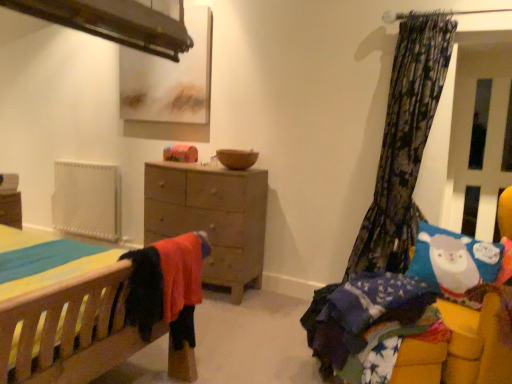
Question: Could you tell me if matte brown picture frame at upper center is facing fluffy blue blanket at lower right, placed as the 2th bed when sorted from left to right?

Choices:
 (A) yes
 (B) no

Answer: (B)

Question: From a real-world perspective, is matte brown picture frame at upper center beneath fluffy blue blanket at lower right, which is the 1th bed in right-to-left order?

Choices:
 (A) no
 (B) yes

Answer: (A)

Question: Is matte brown picture frame at upper center taller than fluffy blue blanket at lower right, placed as the 2th bed when sorted from left to right?

Choices:
 (A) yes
 (B) no

Answer: (A)

Question: Is matte brown picture frame at upper center outside of fluffy blue blanket at lower right, which is the 1th bed in right-to-left order?

Choices:
 (A) yes
 (B) no

Answer: (A)

Question: Considering the relative positions of matte brown picture frame at upper center and fluffy blue blanket at lower right, which is the 1th bed in right-to-left order, in the image provided, is matte brown picture frame at upper center to the left of fluffy blue blanket at lower right, which is the 1th bed in right-to-left order, from the viewer's perspective?

Choices:
 (A) no
 (B) yes

Answer: (B)

Question: Does matte brown picture frame at upper center touch fluffy blue blanket at lower right, which is the 1th bed in right-to-left order?

Choices:
 (A) yes
 (B) no

Answer: (B)

Question: Does matte brown picture frame at upper center have a greater height compared to transparent plastic screen door at right?

Choices:
 (A) no
 (B) yes

Answer: (A)

Question: Can you confirm if matte brown picture frame at upper center is wider than transparent plastic screen door at right?

Choices:
 (A) no
 (B) yes

Answer: (B)

Question: Can you confirm if matte brown picture frame at upper center is bigger than transparent plastic screen door at right?

Choices:
 (A) yes
 (B) no

Answer: (A)

Question: Does matte brown picture frame at upper center have a lesser width compared to transparent plastic screen door at right?

Choices:
 (A) no
 (B) yes

Answer: (A)

Question: Is matte brown picture frame at upper center oriented towards transparent plastic screen door at right?

Choices:
 (A) yes
 (B) no

Answer: (B)

Question: Considering the relative positions of matte brown picture frame at upper center and transparent plastic screen door at right in the image provided, is matte brown picture frame at upper center to the right of transparent plastic screen door at right from the viewer's perspective?

Choices:
 (A) yes
 (B) no

Answer: (B)

Question: Does brown matte bowl at center have a lesser width compared to transparent plastic screen door at right?

Choices:
 (A) yes
 (B) no

Answer: (B)